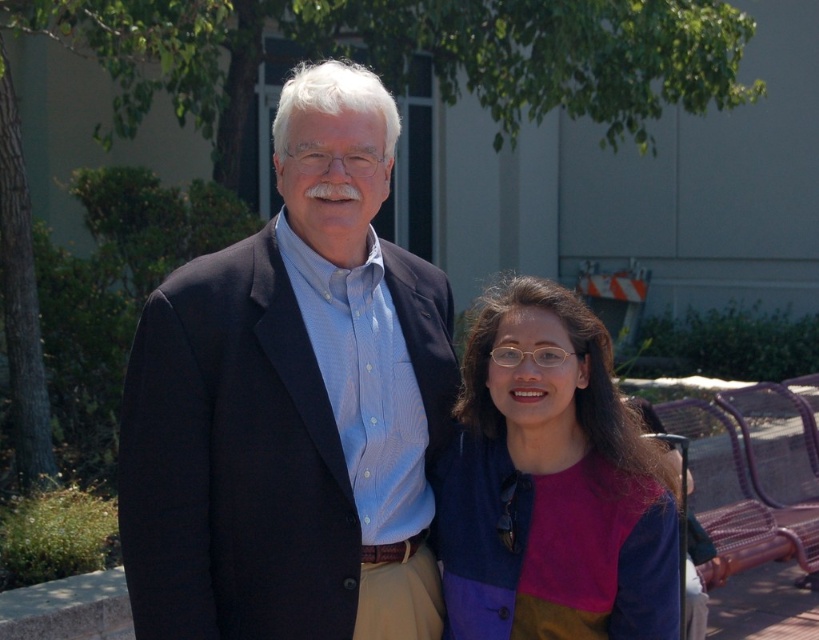
Does point (431, 369) lie behind point (600, 340)?

That is True.

What do you see at coordinates (292, 404) in the screenshot?
I see `matte black suit at center` at bounding box center [292, 404].

Find the location of a particular element. matte black suit at center is located at coordinates (292, 404).